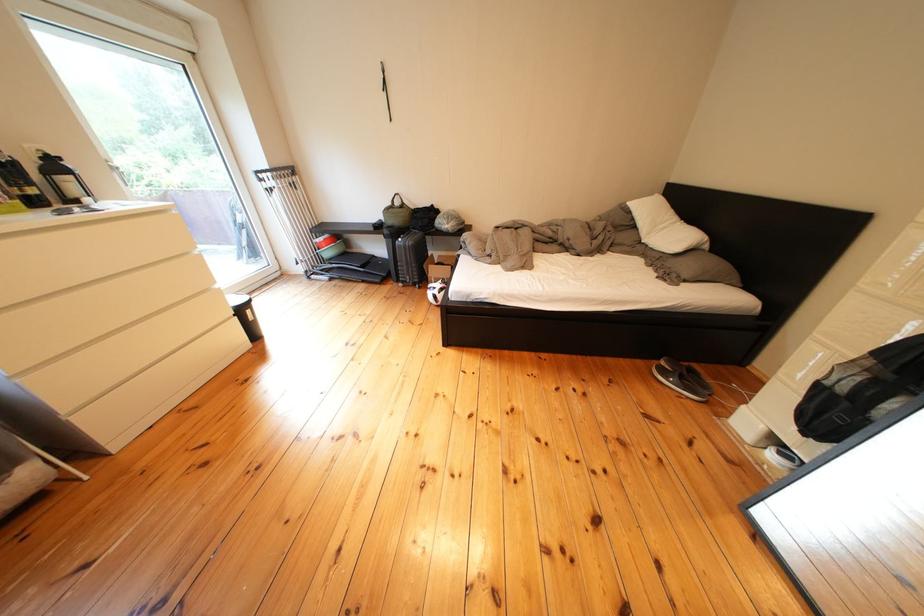
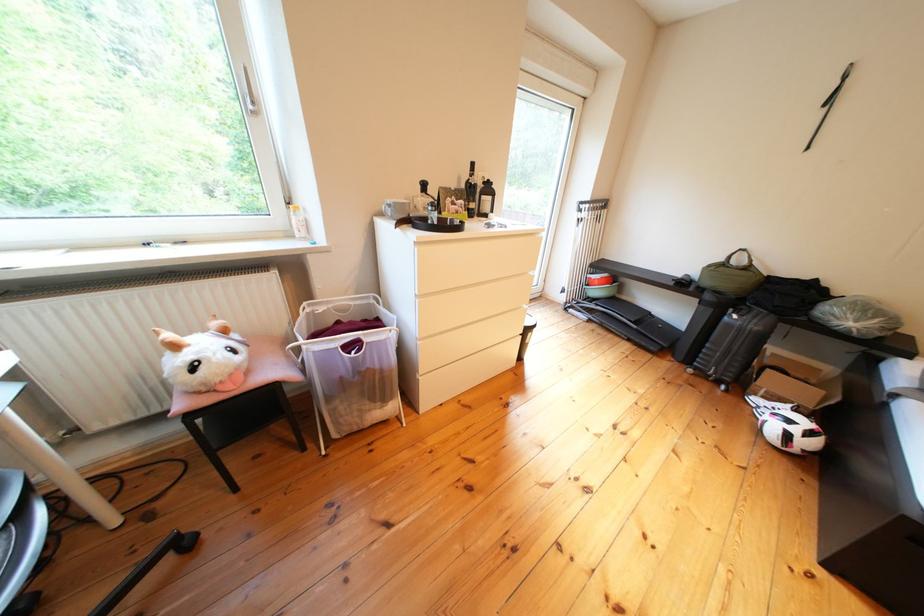
Question: The camera is either moving clockwise (left) or counter-clockwise (right) around the object. The first image is from the beginning of the video and the second image is from the end. Is the camera moving left or right when shooting the video?

Choices:
 (A) Left
 (B) Right

Answer: (B)